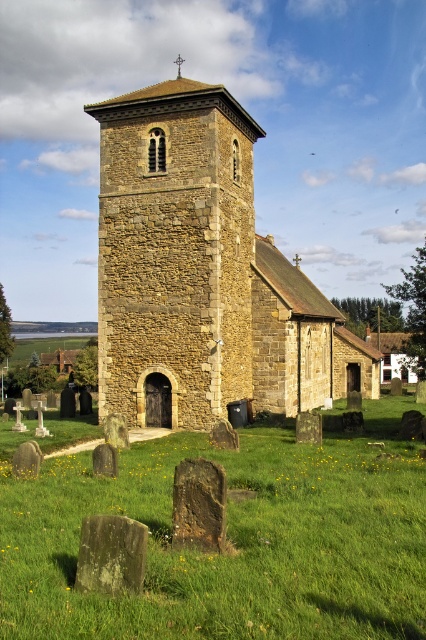
Is brown stone church at center further to camera compared to dark gray stone gravestone at lower left?

That is True.

Between point (158, 156) and point (143, 532), which one is positioned in front?

Positioned in front is point (143, 532).

Is point (317, 292) positioned after point (108, 566)?

Yes, point (317, 292) is farther from viewer.

In order to click on brown stone church at center in this screenshot , I will do `click(203, 273)`.

Does dark gray stone gravestone at lower left have a greater width compared to dark brown stone gravestone at lower center?

Indeed, dark gray stone gravestone at lower left has a greater width compared to dark brown stone gravestone at lower center.

Which is below, dark gray stone gravestone at lower left or dark brown stone gravestone at lower center?

dark gray stone gravestone at lower left is below.

Does point (88, 557) come behind point (198, 488)?

That is False.

You are a GUI agent. You are given a task and a screenshot of the screen. Output one action in this format:
    pyautogui.click(x=<x>, y=<y>)
    Task: Click on the dark gray stone gravestone at lower left
    This screenshot has width=426, height=640.
    Given the screenshot: What is the action you would take?
    pyautogui.click(x=111, y=554)

Is brown stone church at center above dark brown stone gravestone at lower center?

Correct, brown stone church at center is located above dark brown stone gravestone at lower center.

Does brown stone church at center appear on the right side of dark brown stone gravestone at lower center?

Incorrect, brown stone church at center is not on the right side of dark brown stone gravestone at lower center.

What are the coordinates of `brown stone church at center` in the screenshot? It's located at click(203, 273).